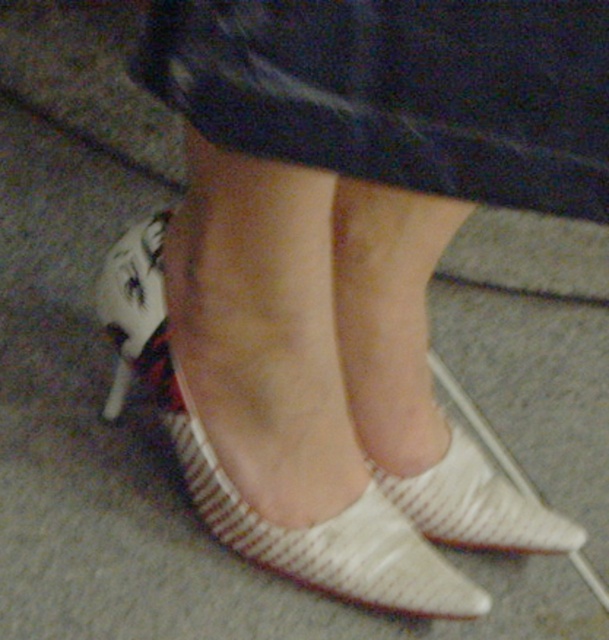
Question: Is white textured sandal at lower center to the right of white textured shoe at center from the viewer's perspective?

Choices:
 (A) yes
 (B) no

Answer: (B)

Question: Is white textured dress at center closer to camera compared to white textured sandal at lower center?

Choices:
 (A) no
 (B) yes

Answer: (B)

Question: Can you confirm if white textured dress at center is positioned to the right of white textured shoe at center?

Choices:
 (A) yes
 (B) no

Answer: (B)

Question: Which of the following is the farthest from the observer?

Choices:
 (A) white textured shoe at center
 (B) white textured sandal at lower center

Answer: (A)

Question: Which point is closer to the camera taking this photo?

Choices:
 (A) (155, 330)
 (B) (535, 525)

Answer: (A)

Question: Which of the following is the closest to the observer?

Choices:
 (A) white textured sandal at lower center
 (B) white textured shoe at center

Answer: (A)